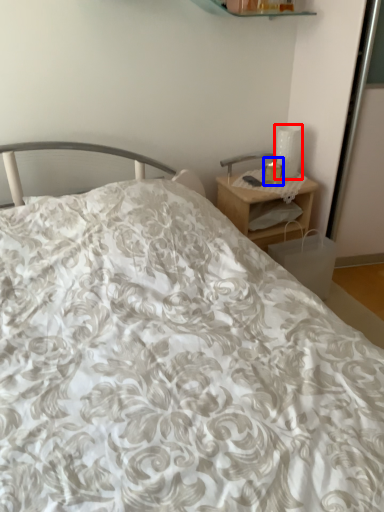
Question: Which of the following is the closest to the observer, table lamp (highlighted by a red box) or candle holder (highlighted by a blue box)?

Choices:
 (A) table lamp
 (B) candle holder

Answer: (B)